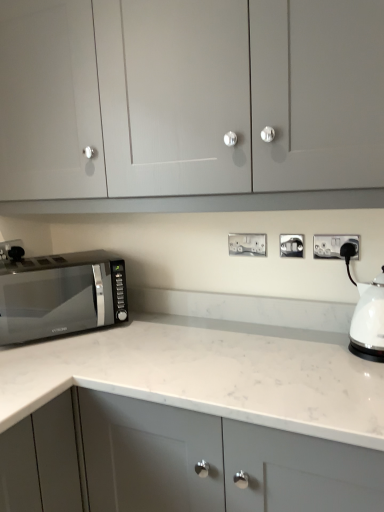
This screenshot has height=512, width=384. Describe the element at coordinates (59, 297) in the screenshot. I see `satin black microwave at lower left` at that location.

Identify the location of satin silver socket at center, the 2th electric outlet from the front. (291, 245).

You are a GUI agent. You are given a task and a screenshot of the screen. Output one action in this format:
    pyautogui.click(x=<x>, y=<y>)
    Task: Click on the matte gray cabinet at upper center
    
    Given the screenshot: What is the action you would take?
    pyautogui.click(x=235, y=104)

The image size is (384, 512). I want to click on silver metallic socket at center, the 2th electric outlet when ordered from back to front, so (247, 244).

Locate an element on the screen. The width and height of the screenshot is (384, 512). white plastic electric outlet at center right, which is counted as the fourth electric outlet, starting from the back is located at coordinates (333, 245).

The image size is (384, 512). What do you see at coordinates (369, 321) in the screenshot? I see `white glossy kettle at right` at bounding box center [369, 321].

Image resolution: width=384 pixels, height=512 pixels. What are the coordinates of `satin silver socket at lower left, the fourth electric outlet in the right-to-left sequence` in the screenshot? It's located at (12, 250).

Locate an element on the screen. white marble countertop at center is located at coordinates (207, 377).

Is white glossy kettle at right next to satin silver socket at lower left, arranged as the 1th electric outlet when viewed from the left?

white glossy kettle at right and satin silver socket at lower left, arranged as the 1th electric outlet when viewed from the left, are not in contact.

From the image's perspective, is white glossy kettle at right above or below satin silver socket at lower left, the first electric outlet when ordered from back to front?

Clearly, from the image's perspective, white glossy kettle at right is below satin silver socket at lower left, the first electric outlet when ordered from back to front.

Is white glossy kettle at right positioned behind satin silver socket at lower left, the fourth electric outlet in the right-to-left sequence?

No, it is in front of satin silver socket at lower left, the fourth electric outlet in the right-to-left sequence.

Could you tell me if satin silver socket at center, the 3th electric outlet from the back, is facing matte gray cabinet at upper center?

No, satin silver socket at center, the 3th electric outlet from the back, is not oriented towards matte gray cabinet at upper center.

From the image's perspective, is satin silver socket at center, the 2th electric outlet from the front, under matte gray cabinet at upper center?

Yes, from the image's perspective, satin silver socket at center, the 2th electric outlet from the front, is beneath matte gray cabinet at upper center.

Looking at this image, from a real-world perspective, is satin silver socket at center, the third electric outlet in the left-to-right sequence, over matte gray cabinet at upper center?

No.

Between satin silver socket at center, the 3th electric outlet from the back, and matte gray cabinet at upper center, which one has smaller size?

satin silver socket at center, the 3th electric outlet from the back.

Between white plastic electric outlet at center right, which ranks as the fourth electric outlet in left-to-right order, and satin silver socket at lower left, arranged as the 1th electric outlet when viewed from the left, which one is positioned behind?

satin silver socket at lower left, arranged as the 1th electric outlet when viewed from the left.

From a real-world perspective, between white plastic electric outlet at center right, which is counted as the fourth electric outlet, starting from the back, and satin silver socket at lower left, the first electric outlet when ordered from back to front, who is vertically higher?

In real-world perspective, white plastic electric outlet at center right, which is counted as the fourth electric outlet, starting from the back, is above.

Between white plastic electric outlet at center right, which ranks as the fourth electric outlet in left-to-right order, and satin silver socket at lower left, the first electric outlet when ordered from back to front, which one has larger size?

satin silver socket at lower left, the first electric outlet when ordered from back to front.

How distant is white plastic electric outlet at center right, which is the 1th electric outlet in right-to-left order, from satin silver socket at lower left, which is counted as the fourth electric outlet, starting from the front?

A distance of 4.06 feet exists between white plastic electric outlet at center right, which is the 1th electric outlet in right-to-left order, and satin silver socket at lower left, which is counted as the fourth electric outlet, starting from the front.

How much distance is there between matte gray cabinet at upper center and satin black microwave at lower left?

matte gray cabinet at upper center is 24.27 inches away from satin black microwave at lower left.

Does matte gray cabinet at upper center contain satin black microwave at lower left?

That's incorrect, satin black microwave at lower left is not inside matte gray cabinet at upper center.

Between point (194, 75) and point (24, 341), which one is positioned behind?

Positioned behind is point (24, 341).

Identify the location of cabinetry located in front of the satin black microwave at lower left. (235, 104).

From the image's perspective, which one is positioned lower, silver metallic socket at center, the 3th electric outlet positioned from the front, or satin black microwave at lower left?

satin black microwave at lower left is shown below in the image.

Is silver metallic socket at center, the second electric outlet viewed from the left, directly adjacent to satin black microwave at lower left?

There is a gap between silver metallic socket at center, the second electric outlet viewed from the left, and satin black microwave at lower left.

Where is `microwave oven lying below the silver metallic socket at center, the 2th electric outlet when ordered from back to front (from the image's perspective)`? The width and height of the screenshot is (384, 512). microwave oven lying below the silver metallic socket at center, the 2th electric outlet when ordered from back to front (from the image's perspective) is located at coordinates (59, 297).

Looking at this image, is silver metallic socket at center, the 3th electric outlet positioned from the front, facing away from satin black microwave at lower left?

No, silver metallic socket at center, the 3th electric outlet positioned from the front, is not facing away from satin black microwave at lower left.

From a real-world perspective, which object stands above the other?

satin black microwave at lower left.

Can you confirm if white glossy kettle at right is smaller than satin black microwave at lower left?

Yes, white glossy kettle at right is smaller than satin black microwave at lower left.

Where is `coffeepot that appears on the right of satin black microwave at lower left`? Image resolution: width=384 pixels, height=512 pixels. coffeepot that appears on the right of satin black microwave at lower left is located at coordinates (369, 321).

Is white marble countertop at center at the left side of satin silver socket at lower left, which is counted as the fourth electric outlet, starting from the front?

In fact, white marble countertop at center is to the right of satin silver socket at lower left, which is counted as the fourth electric outlet, starting from the front.

The width and height of the screenshot is (384, 512). I want to click on countertop in front of the satin silver socket at lower left, the first electric outlet when ordered from back to front, so click(x=207, y=377).

From a real-world perspective, does white marble countertop at center sit lower than satin silver socket at lower left, the fourth electric outlet in the right-to-left sequence?

Yes, from a real-world perspective, white marble countertop at center is under satin silver socket at lower left, the fourth electric outlet in the right-to-left sequence.

Where is `the 4th electric outlet to the left of the white glossy kettle at right, counting from the anchor's position`? This screenshot has width=384, height=512. the 4th electric outlet to the left of the white glossy kettle at right, counting from the anchor's position is located at coordinates (12, 250).

What are the coordinates of `cabinetry lying above the satin silver socket at center, the third electric outlet in the left-to-right sequence (from the image's perspective)` in the screenshot? It's located at (235, 104).

Based on their spatial positions, is white marble countertop at center or satin silver socket at lower left, arranged as the 1th electric outlet when viewed from the left, further from satin black microwave at lower left?

white marble countertop at center is further to satin black microwave at lower left.

From the image, which object appears to be farther from white plastic electric outlet at center right, the first electric outlet from the front, white marble countertop at center or satin silver socket at lower left, which is counted as the fourth electric outlet, starting from the front?

satin silver socket at lower left, which is counted as the fourth electric outlet, starting from the front, lies further to white plastic electric outlet at center right, the first electric outlet from the front, than the other object.

In the scene shown: From the image, which object appears to be nearer to matte gray cabinet at upper center, silver metallic socket at center, the 3th electric outlet positioned from the front, or satin black microwave at lower left?

silver metallic socket at center, the 3th electric outlet positioned from the front, lies closer to matte gray cabinet at upper center than the other object.

Considering their positions, is white glossy kettle at right positioned closer to satin silver socket at lower left, which is counted as the fourth electric outlet, starting from the front, than white marble countertop at center?

The object closer to satin silver socket at lower left, which is counted as the fourth electric outlet, starting from the front, is white marble countertop at center.

Based on their spatial positions, is satin silver socket at center, the 2th electric outlet from the front, or matte gray cabinet at upper center further from satin black microwave at lower left?

satin silver socket at center, the 2th electric outlet from the front.

Based on their spatial positions, is white glossy kettle at right or satin silver socket at lower left, which is counted as the fourth electric outlet, starting from the front, further from satin silver socket at center, the second electric outlet in the right-to-left sequence?

satin silver socket at lower left, which is counted as the fourth electric outlet, starting from the front, lies further to satin silver socket at center, the second electric outlet in the right-to-left sequence, than the other object.

Which object lies nearer to the anchor point white glossy kettle at right, satin silver socket at lower left, the first electric outlet when ordered from back to front, or matte gray cabinet at upper center?

Among the two, matte gray cabinet at upper center is located nearer to white glossy kettle at right.

Estimate the real-world distances between objects in this image. Which object is closer to white plastic electric outlet at center right, which ranks as the fourth electric outlet in left-to-right order, satin silver socket at lower left, the first electric outlet when ordered from back to front, or matte gray cabinet at upper center?

The object closer to white plastic electric outlet at center right, which ranks as the fourth electric outlet in left-to-right order, is matte gray cabinet at upper center.

Find the location of a particular element. countertop situated between satin black microwave at lower left and white plastic electric outlet at center right, which is counted as the fourth electric outlet, starting from the back, from left to right is located at coordinates (207, 377).

I want to click on cabinetry between satin black microwave at lower left and satin silver socket at center, the third electric outlet in the left-to-right sequence, in the horizontal direction, so click(235, 104).

The height and width of the screenshot is (512, 384). In order to click on countertop situated between satin silver socket at lower left, the fourth electric outlet in the right-to-left sequence, and silver metallic socket at center, the second electric outlet viewed from the left, from left to right in this screenshot , I will do `click(207, 377)`.

You are a GUI agent. You are given a task and a screenshot of the screen. Output one action in this format:
    pyautogui.click(x=<x>, y=<y>)
    Task: Click on the countertop located between satin silver socket at lower left, arranged as the 1th electric outlet when viewed from the left, and white glossy kettle at right in the left-right direction
    This screenshot has width=384, height=512.
    Given the screenshot: What is the action you would take?
    pyautogui.click(x=207, y=377)